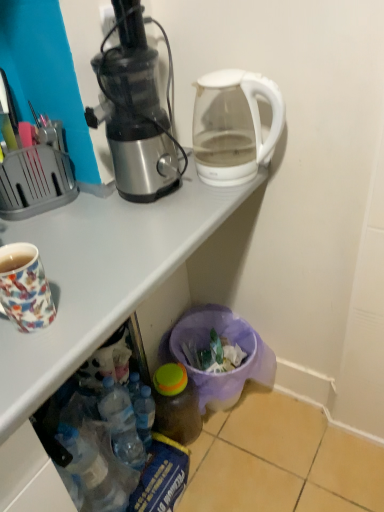
Question: In the image, is multicolored ceramic mug at left positioned in front of or behind metallic silver juicer at left?

Choices:
 (A) behind
 (B) front

Answer: (B)

Question: In the image, is multicolored ceramic mug at left on the left side or the right side of metallic silver juicer at left?

Choices:
 (A) left
 (B) right

Answer: (A)

Question: Which is farther from the multicolored ceramic mug at left?

Choices:
 (A) metallic silver juicer at left
 (B) translucent plastic bottle at lower center, the second bottle in the right-to-left sequence
 (C) transparent glass kettle at upper right
 (D) white glossy desk at upper center
 (E) translucent plastic bottle at lower center, acting as the first bottle starting from the right

Answer: (E)

Question: Based on their relative distances, which object is farther from the metallic silver juicer at left?

Choices:
 (A) white glossy desk at upper center
 (B) transparent glass kettle at upper right
 (C) translucent plastic bottle at lower center, which ranks as the 2th bottle in left-to-right order
 (D) multicolored ceramic mug at left
 (E) translucent plastic bottle at lower center, placed as the 1th bottle when sorted from left to right

Answer: (E)